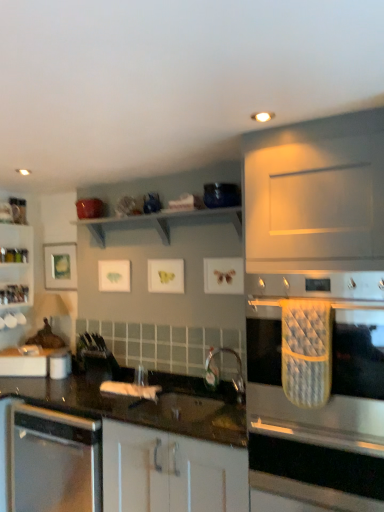
Question: Can you confirm if clear glass shelves at left is bigger than blue glossy bowl at upper center, which ranks as the 1th appliance in top-to-bottom order?

Choices:
 (A) no
 (B) yes

Answer: (B)

Question: Is clear glass shelves at left at the right side of blue glossy bowl at upper center, the first appliance positioned from the front?

Choices:
 (A) yes
 (B) no

Answer: (B)

Question: Considering the relative sizes of clear glass shelves at left and blue glossy bowl at upper center, the second appliance positioned from the back, in the image provided, is clear glass shelves at left smaller than blue glossy bowl at upper center, the second appliance positioned from the back,?

Choices:
 (A) no
 (B) yes

Answer: (A)

Question: Is clear glass shelves at left to the left of blue glossy bowl at upper center, the first appliance positioned from the front, from the viewer's perspective?

Choices:
 (A) no
 (B) yes

Answer: (B)

Question: Is clear glass shelves at left with blue glossy bowl at upper center, which ranks as the 1th appliance in top-to-bottom order?

Choices:
 (A) no
 (B) yes

Answer: (A)

Question: Is clear glass shelves at left wider than blue glossy bowl at upper center, placed as the 2th appliance when sorted from left to right?

Choices:
 (A) yes
 (B) no

Answer: (B)

Question: Considering the relative sizes of satin black countertop at lower left and stainless steel oven mitt at right in the image provided, is satin black countertop at lower left bigger than stainless steel oven mitt at right?

Choices:
 (A) yes
 (B) no

Answer: (A)

Question: From the image's perspective, does satin black countertop at lower left appear higher than stainless steel oven mitt at right?

Choices:
 (A) no
 (B) yes

Answer: (A)

Question: Considering the relative sizes of satin black countertop at lower left and stainless steel oven mitt at right in the image provided, is satin black countertop at lower left shorter than stainless steel oven mitt at right?

Choices:
 (A) no
 (B) yes

Answer: (A)

Question: Is satin black countertop at lower left smaller than stainless steel oven mitt at right?

Choices:
 (A) no
 (B) yes

Answer: (A)

Question: Could you tell me if satin black countertop at lower left is turned towards stainless steel oven mitt at right?

Choices:
 (A) no
 (B) yes

Answer: (A)

Question: From the image's perspective, is satin black countertop at lower left below stainless steel oven mitt at right?

Choices:
 (A) yes
 (B) no

Answer: (A)

Question: Could white glossy cabinet at center be considered to be inside stainless steel oven mitt at right?

Choices:
 (A) yes
 (B) no

Answer: (B)